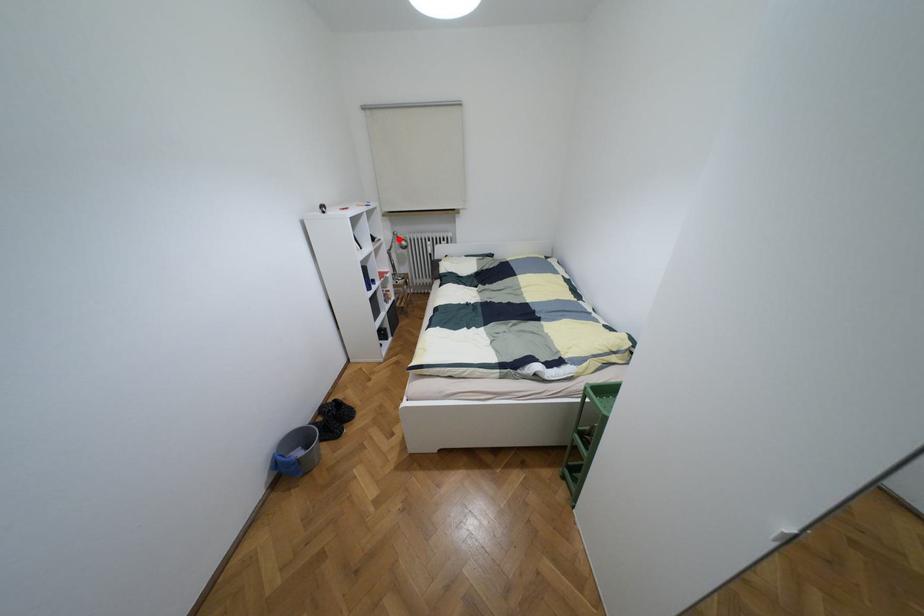
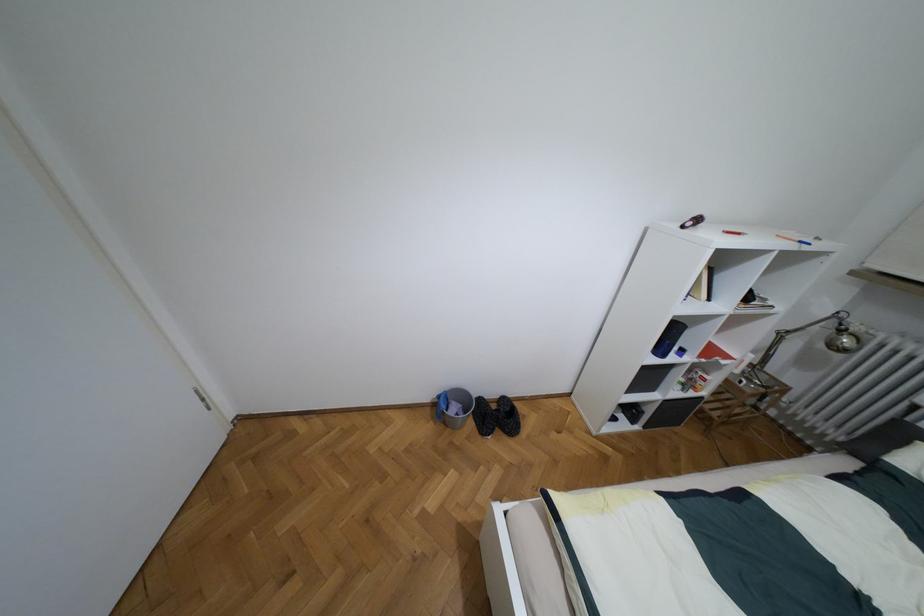
The point at the highlighted location is marked in the first image. Where is the corresponding point in the second image?

(840, 330)